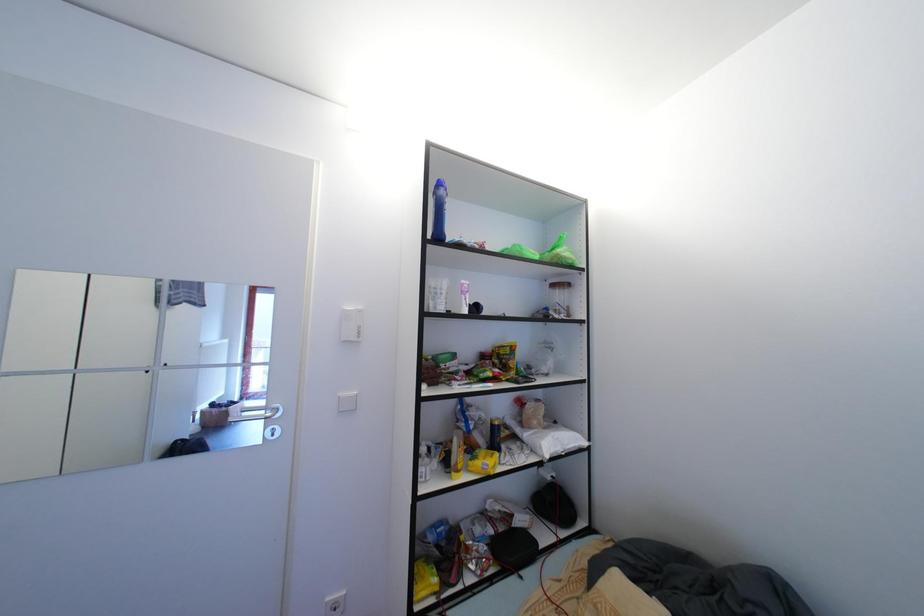
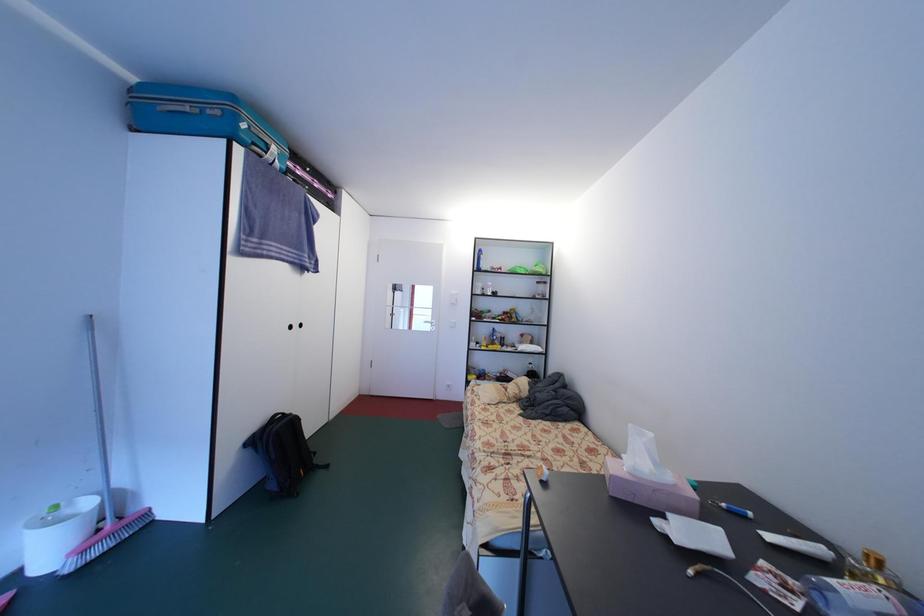
From the picture: In a continuous first-person perspective shot, in which direction is the camera moving?

The movement direction of the cameraman is right, backward.